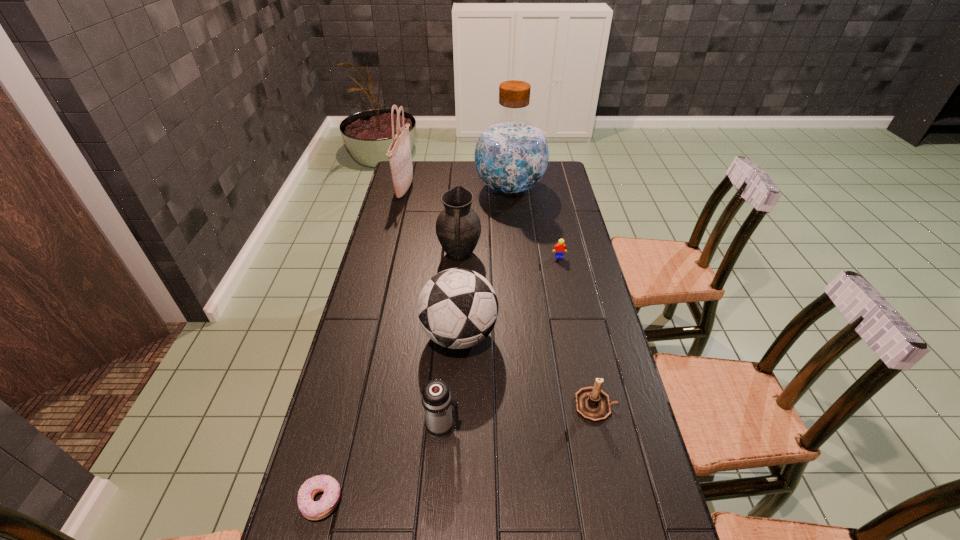
Where is `vacant point located 0.300m on the front of the shopping bag`? The width and height of the screenshot is (960, 540). vacant point located 0.300m on the front of the shopping bag is located at coordinates (389, 251).

Where is `free space located 0.400m on the side of the pitcher with the handle`? The height and width of the screenshot is (540, 960). free space located 0.400m on the side of the pitcher with the handle is located at coordinates tap(453, 363).

Find the location of a particular element. The image size is (960, 540). vacant region located 0.310m on the surface of the fourth nearest object where the brand logo is visible is located at coordinates [600, 335].

Identify the location of free spot located 0.120m on the side with the handle of the fourth shortest object. The image size is (960, 540). (507, 428).

Find the location of a particular element. This screenshot has width=960, height=540. vacant position located 0.230m on the front of the sixth tallest object is located at coordinates (621, 521).

The width and height of the screenshot is (960, 540). I want to click on free location located 0.210m on the front-facing side of the second shortest object, so click(x=568, y=300).

Where is `free region located 0.210m on the right of the nearest object`? The height and width of the screenshot is (540, 960). free region located 0.210m on the right of the nearest object is located at coordinates (438, 501).

Find the location of a particular element. water jug positioned at the far edge is located at coordinates (511, 155).

Image resolution: width=960 pixels, height=540 pixels. In order to click on shopping bag that is positioned at the far edge in this screenshot , I will do `click(400, 159)`.

In order to click on shopping bag located in the left edge section of the desktop in this screenshot , I will do `click(400, 159)`.